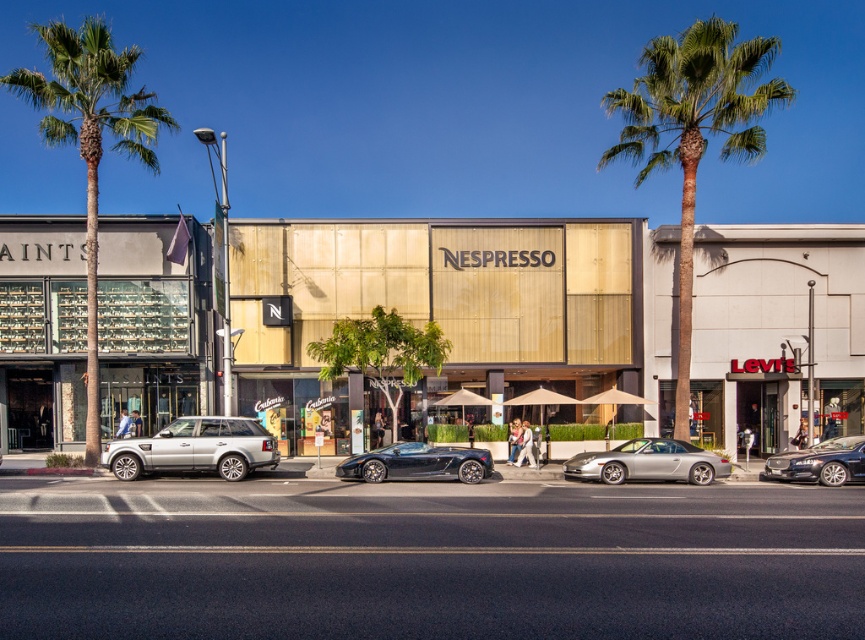
Question: Which object is closer to the camera taking this photo?

Choices:
 (A) gold textured building at center
 (B) shiny black sports car at center
 (C) green leafy palm tree at upper right

Answer: (B)

Question: Which object appears closest to the camera in this image?

Choices:
 (A) green leafy palm tree at left
 (B) silver metallic convertible at center
 (C) shiny black sports car at center

Answer: (C)

Question: Can you confirm if gold metallic building at center is positioned above green leafy palm tree at upper right?

Choices:
 (A) yes
 (B) no

Answer: (B)

Question: Observing the image, what is the correct spatial positioning of gold metallic building at center in reference to green leafy palm tree at upper right?

Choices:
 (A) below
 (B) above

Answer: (A)

Question: Is green leafy palm tree at upper right above shiny black sports car at center?

Choices:
 (A) yes
 (B) no

Answer: (A)

Question: Which point appears closest to the camera in this image?

Choices:
 (A) pos(696,24)
 (B) pos(689,444)
 (C) pos(340,461)
 (D) pos(850,449)

Answer: (D)